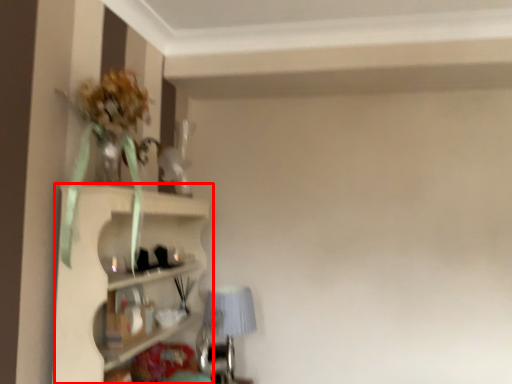
Question: From the image's perspective, considering the relative positions of shelf (annotated by the red box) and table lamp in the image provided, where is shelf (annotated by the red box) located with respect to the staircase?

Choices:
 (A) below
 (B) above

Answer: (B)